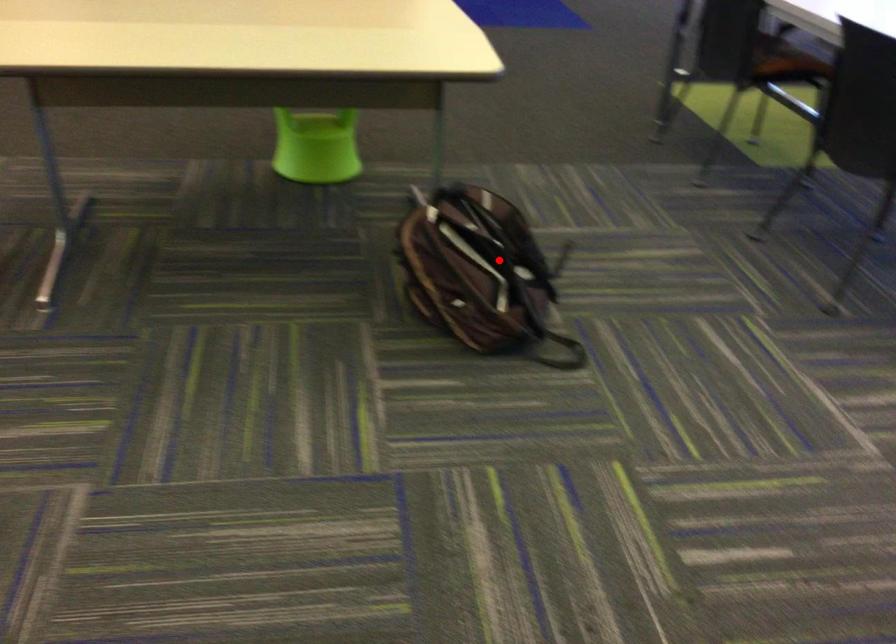
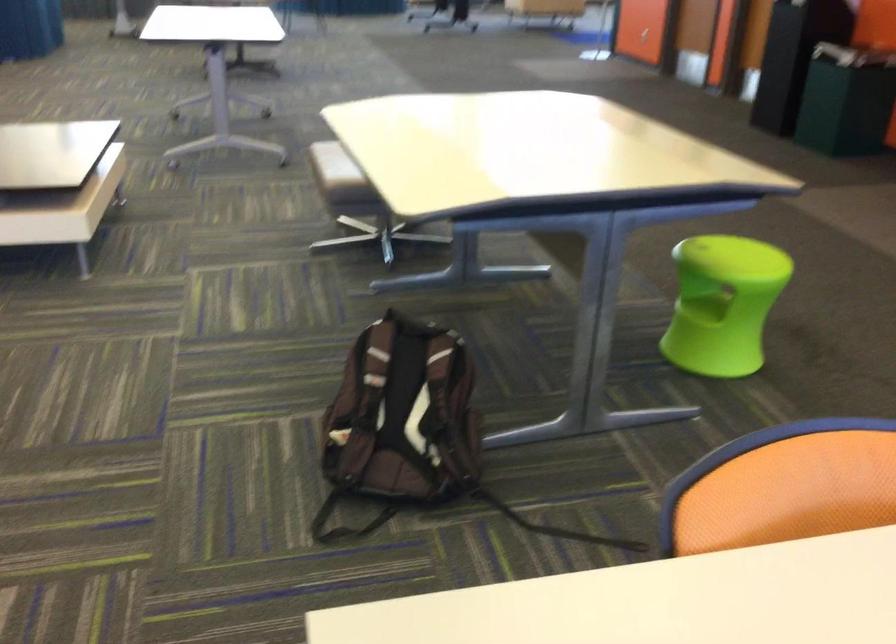
Question: I am providing you with two images of the same scene from different viewpoints. A red point is marked on the first image. At the location where the point appears in image 1, is it still visible in image 2?

Choices:
 (A) Yes
 (B) No

Answer: (A)